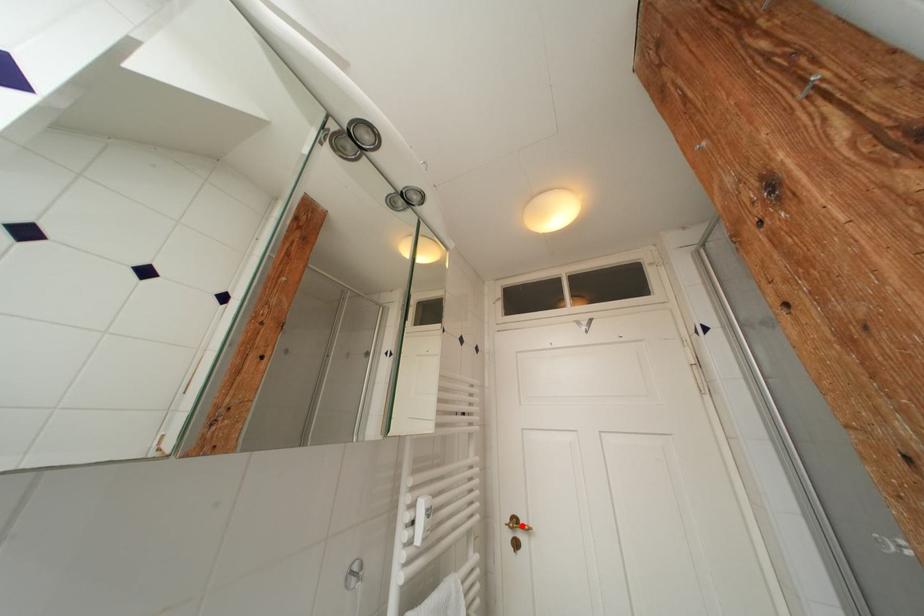
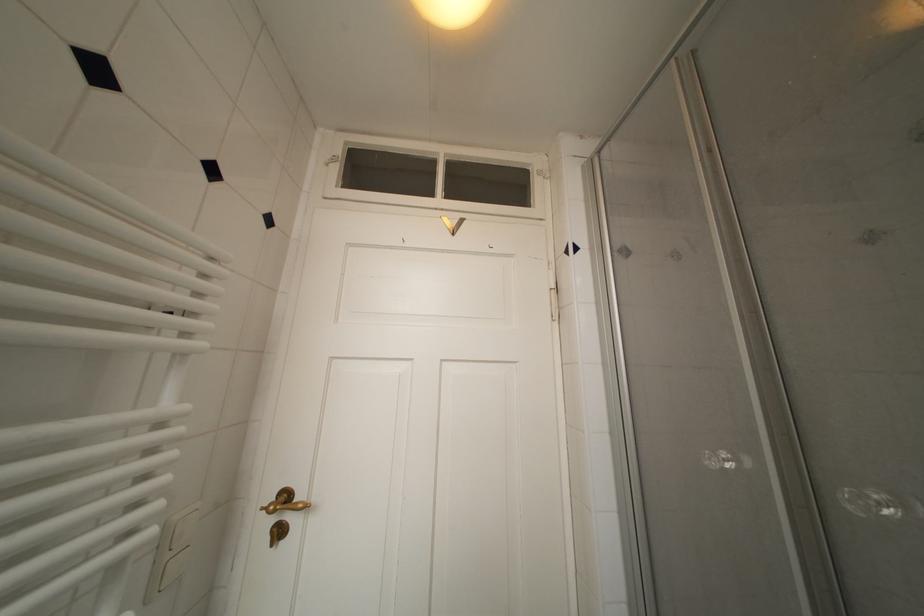
In the second image, find the point that corresponds to the highlighted location in the first image.

(293, 500)